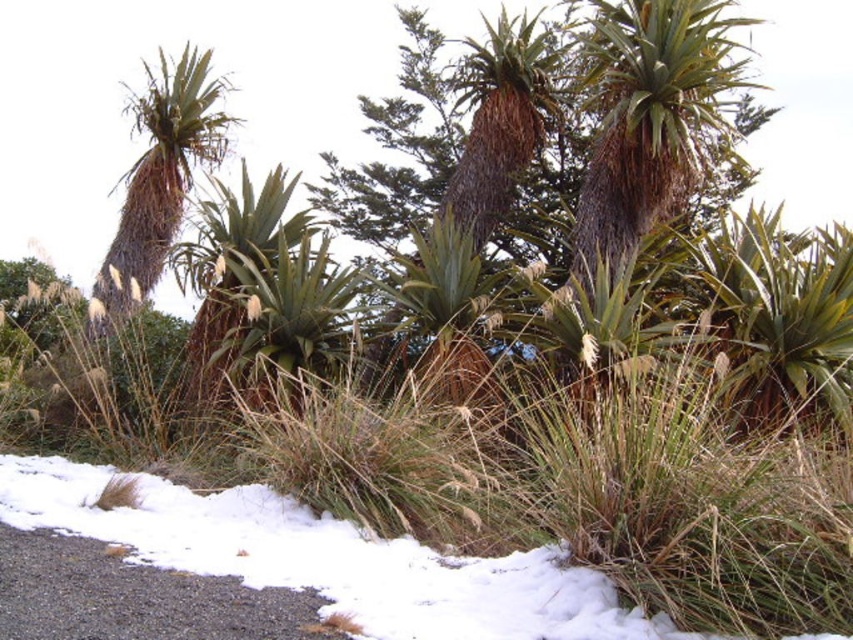
Question: Which object is farther from the camera taking this photo?

Choices:
 (A) green fibrous palm tree at center
 (B) brown textured palm tree at center
 (C) brown textured palm tree at upper center
 (D) green leafy palm tree at center

Answer: (B)

Question: Is the position of brown textured palm tree at upper center less distant than that of brown textured palm tree at center?

Choices:
 (A) yes
 (B) no

Answer: (A)

Question: Can you confirm if brown textured palm tree at upper center is bigger than green leafy palm tree at center?

Choices:
 (A) yes
 (B) no

Answer: (A)

Question: Is brown fibrous palm tree at upper left to the right of green leafy palm tree at center from the viewer's perspective?

Choices:
 (A) yes
 (B) no

Answer: (B)

Question: Which point is closer to the camera taking this photo?

Choices:
 (A) (456, 212)
 (B) (117, 262)

Answer: (A)

Question: Which object is farther from the camera taking this photo?

Choices:
 (A) green fibrous palm tree at center
 (B) brown fibrous palm tree at upper left

Answer: (B)